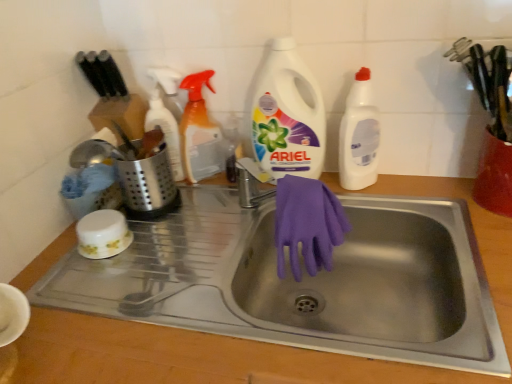
Image resolution: width=512 pixels, height=384 pixels. In order to click on blank area to the left of red plastic container at upper right, the 1th appliance viewed from the right in this screenshot , I will do `click(435, 213)`.